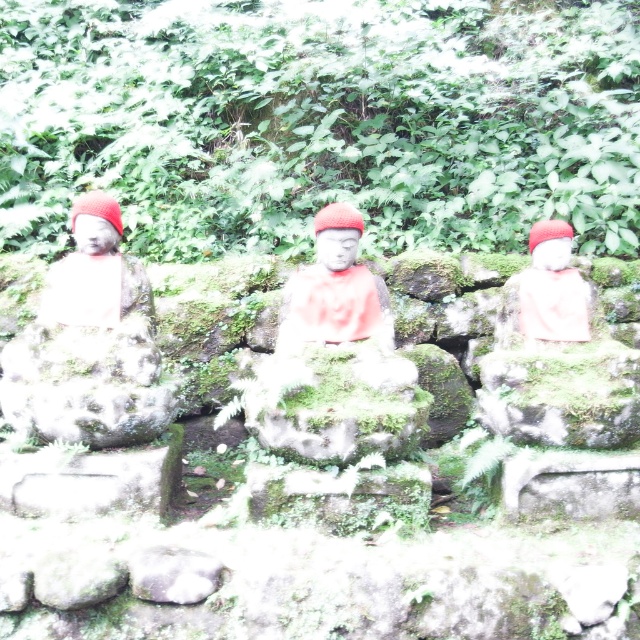
Question: Is matte stone statue at left thinner than white stone monk at left?

Choices:
 (A) yes
 (B) no

Answer: (B)

Question: Is matte stone statue at left wider than matte red statue at center?

Choices:
 (A) no
 (B) yes

Answer: (B)

Question: Does matte stone statue at left have a smaller size compared to matte red statue at center?

Choices:
 (A) no
 (B) yes

Answer: (A)

Question: Which object is farther from the camera taking this photo?

Choices:
 (A) matte red statue at center
 (B) white stone monk at left
 (C) matte stone statue at left

Answer: (A)

Question: Estimate the real-world distances between objects in this image. Which object is farther from the matte stone statue at left?

Choices:
 (A) matte white statue at right
 (B) white stone monk at left

Answer: (A)

Question: Which of the following is the closest to the observer?

Choices:
 (A) (125, 276)
 (B) (355, 232)
 (C) (81, 360)
 (D) (572, 284)

Answer: (C)